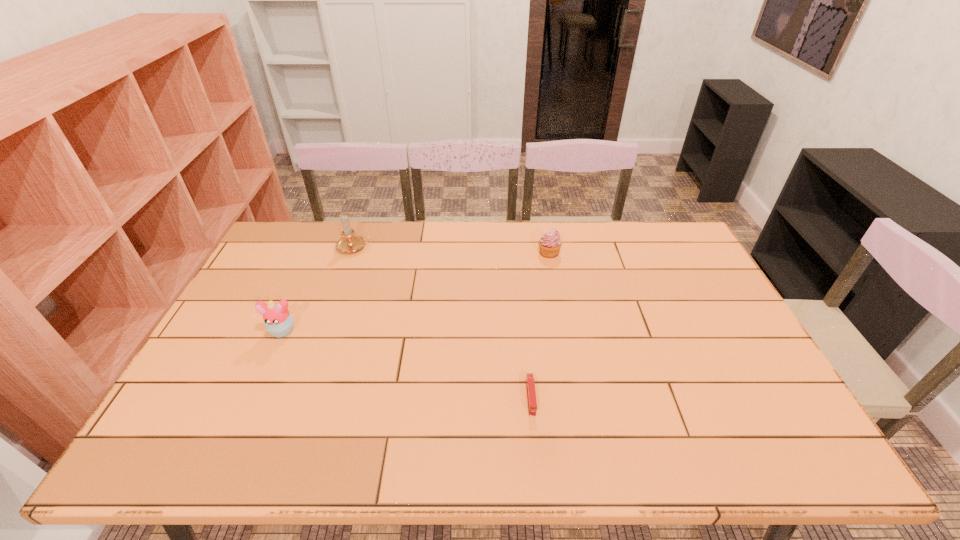
At what (x,y) coordinates should I click in order to perform the action: click on candle. Please return your answer as a coordinate pair (x, y). Looking at the image, I should click on (349, 242).

You are a GUI agent. You are given a task and a screenshot of the screen. Output one action in this format:
    pyautogui.click(x=<x>, y=<y>)
    Task: Click on the leftmost object
    
    Given the screenshot: What is the action you would take?
    pyautogui.click(x=279, y=322)

Locate an element on the screen. The height and width of the screenshot is (540, 960). the taller cupcake is located at coordinates (279, 322).

You are a GUI agent. You are given a task and a screenshot of the screen. Output one action in this format:
    pyautogui.click(x=<x>, y=<y>)
    Task: Click on the shorter cupcake
    This screenshot has width=960, height=540.
    Given the screenshot: What is the action you would take?
    pyautogui.click(x=550, y=243)

This screenshot has width=960, height=540. Find the location of `the right cupcake`. the right cupcake is located at coordinates (550, 243).

This screenshot has height=540, width=960. Identify the location of the nearest object. (530, 384).

Where is `the second object from right to left`? This screenshot has height=540, width=960. the second object from right to left is located at coordinates coord(530,384).

The image size is (960, 540). Identify the location of free spot located on the front of the candle. (333, 307).

What are the coordinates of `vacant space situated 0.150m on the face of the leftmost object` in the screenshot? It's located at (257, 386).

At what (x,y) coordinates should I click in order to perform the action: click on free space located 0.350m on the right of the third tallest object. Please return your answer as a coordinate pair (x, y). Looking at the image, I should click on tap(660, 253).